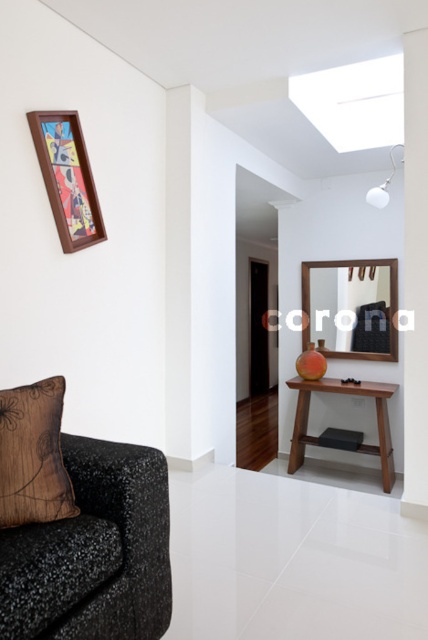
Question: Is brown textured pillow at lower left in front of mahogany wood console table at center?

Choices:
 (A) no
 (B) yes

Answer: (B)

Question: Is black speckled fabric couch at lower left above mahogany wood console table at center?

Choices:
 (A) no
 (B) yes

Answer: (B)

Question: Can you confirm if brown textured pillow at lower left is positioned to the right of mahogany wood console table at center?

Choices:
 (A) no
 (B) yes

Answer: (A)

Question: Which is nearer to the wooden picture frame at upper left?

Choices:
 (A) mahogany wood console table at center
 (B) brown textured pillow at lower left

Answer: (B)

Question: Which object is the closest to the mahogany wood console table at center?

Choices:
 (A) black speckled fabric couch at lower left
 (B) wooden picture frame at upper left
 (C) brown textured pillow at lower left

Answer: (B)

Question: Which of the following is the farthest from the observer?

Choices:
 (A) (59, 381)
 (B) (130, 557)
 (C) (74, 150)
 (D) (380, 387)

Answer: (D)